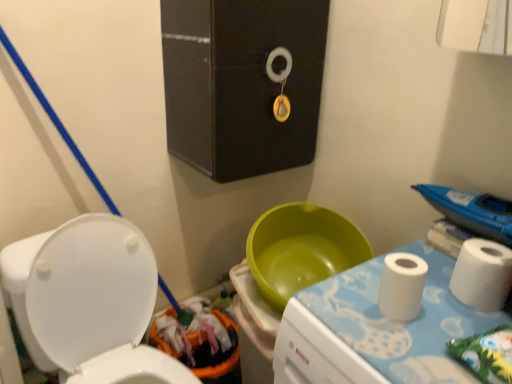
This screenshot has width=512, height=384. Identify the location of blank space to the left of white matte toilet paper at right. (407, 324).